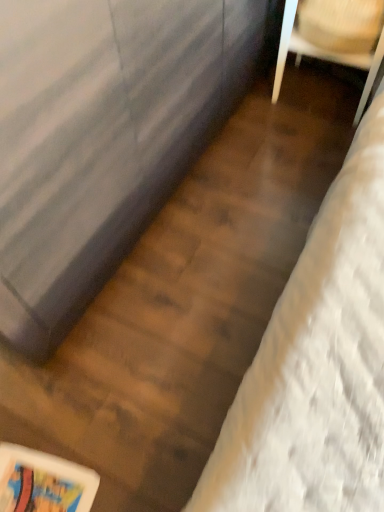
Locate an element on the screen. This screenshot has height=512, width=384. free spot to the left of wooden chair at upper right is located at coordinates (254, 118).